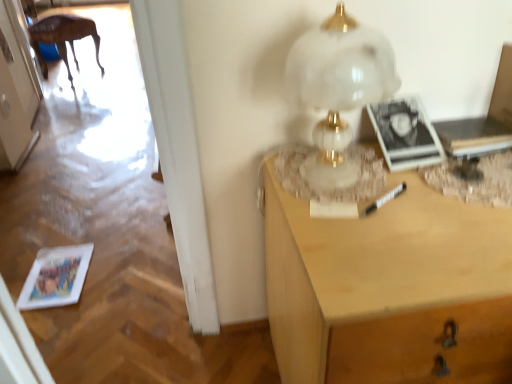
You are a GUI agent. You are given a task and a screenshot of the screen. Output one action in this format:
    pyautogui.click(x=<x>, y=<y>)
    Task: Click on the vacant space behind matte paper magazine at lower left
    
    Given the screenshot: What is the action you would take?
    pyautogui.click(x=76, y=230)